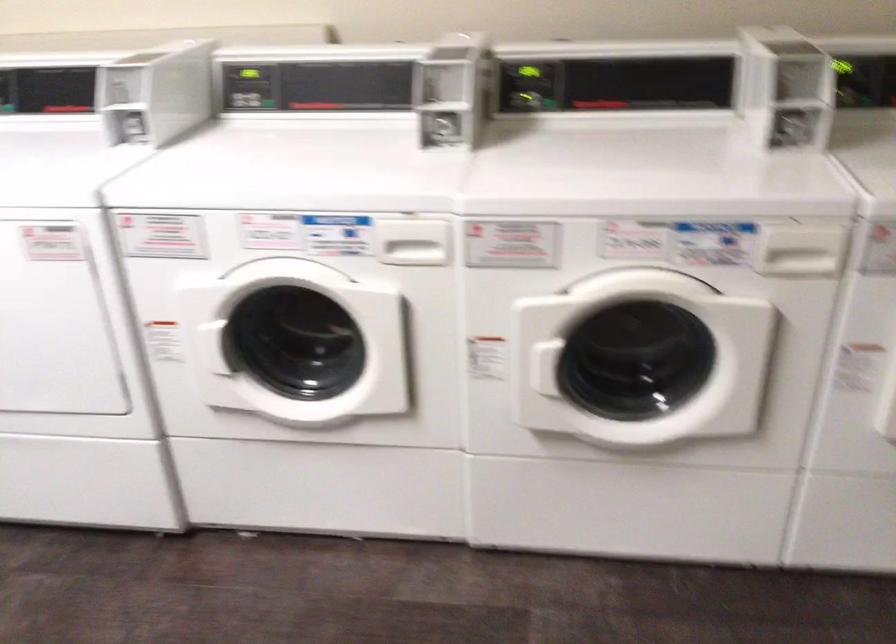
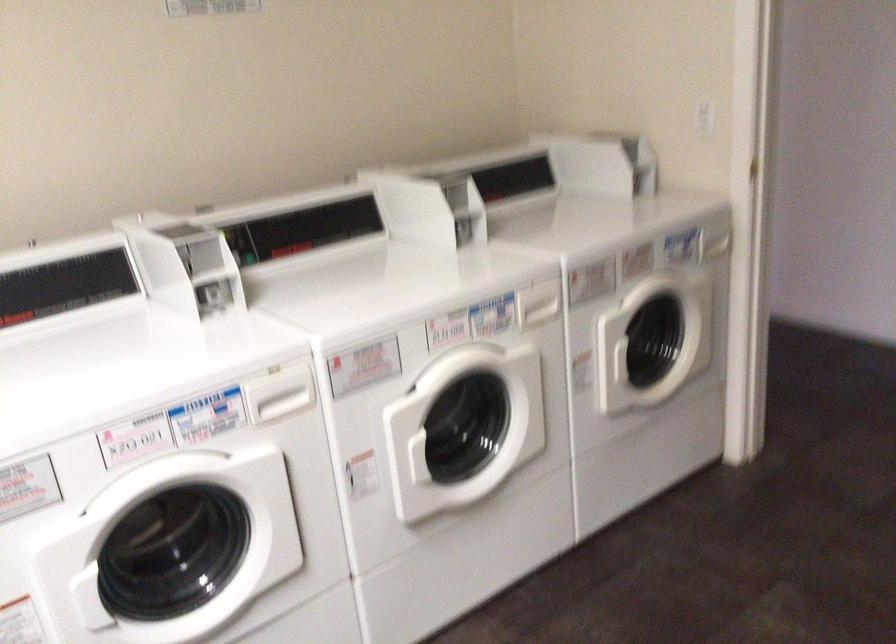
In the second image, find the point that corresponds to (678,243) in the first image.

(474, 322)